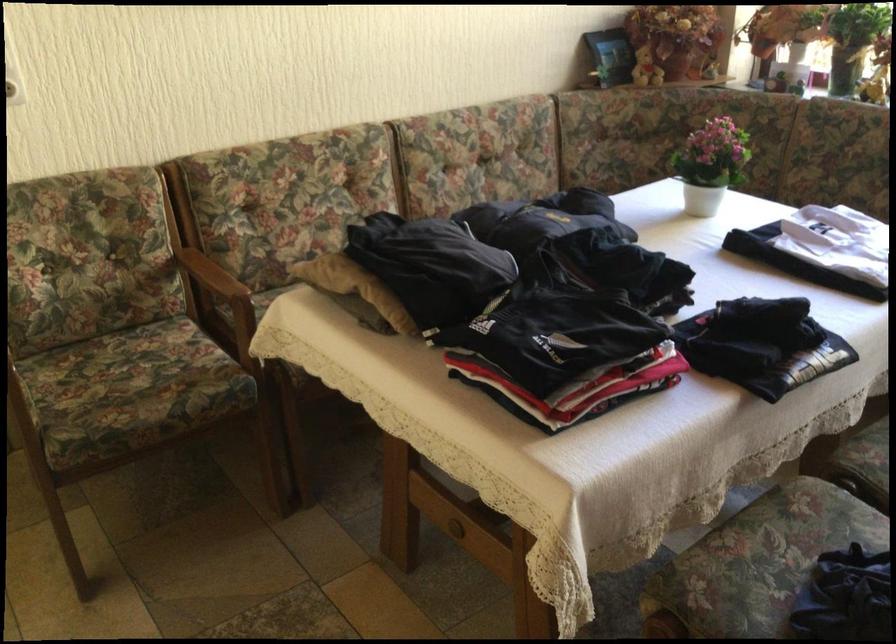
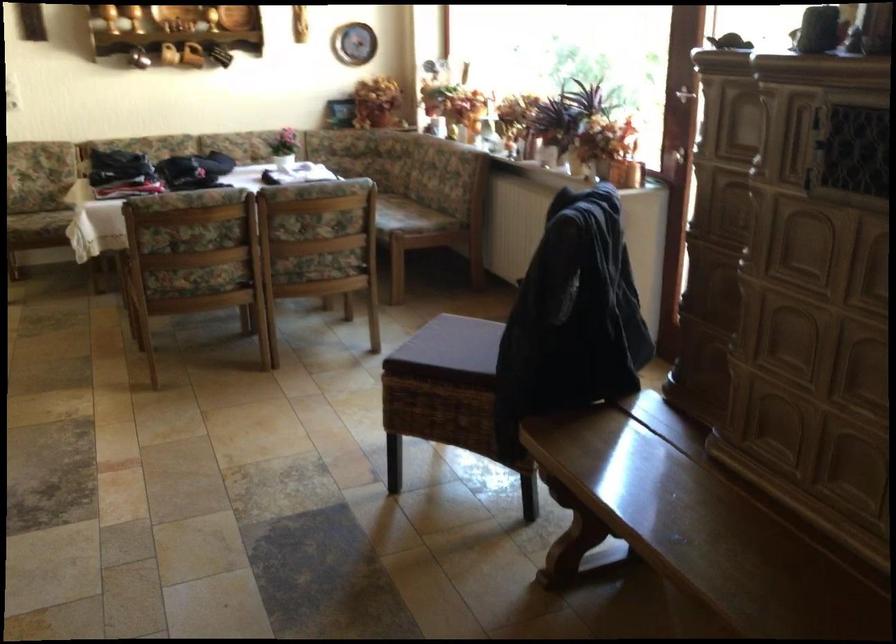
Which direction would the cameraman need to move to produce the second image?

The movement direction of the cameraman is right, backward.